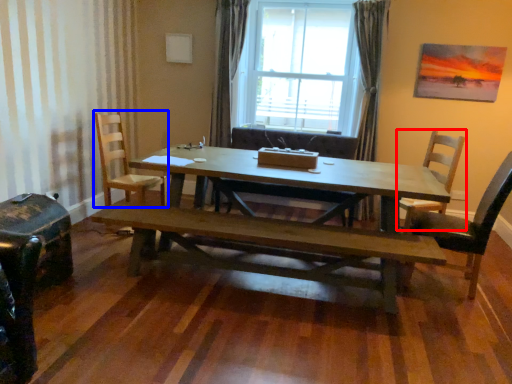
Question: Which of the following is the farthest to the observer, chair (highlighted by a red box) or chair (highlighted by a blue box)?

Choices:
 (A) chair
 (B) chair

Answer: (B)